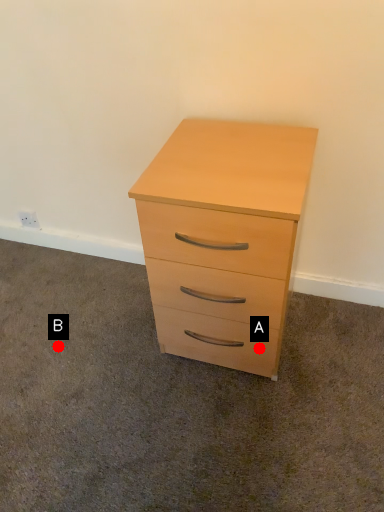
Question: Two points are circled on the image, labeled by A and B beside each circle. Which point is farther to the camera?

Choices:
 (A) A is further
 (B) B is further

Answer: (B)